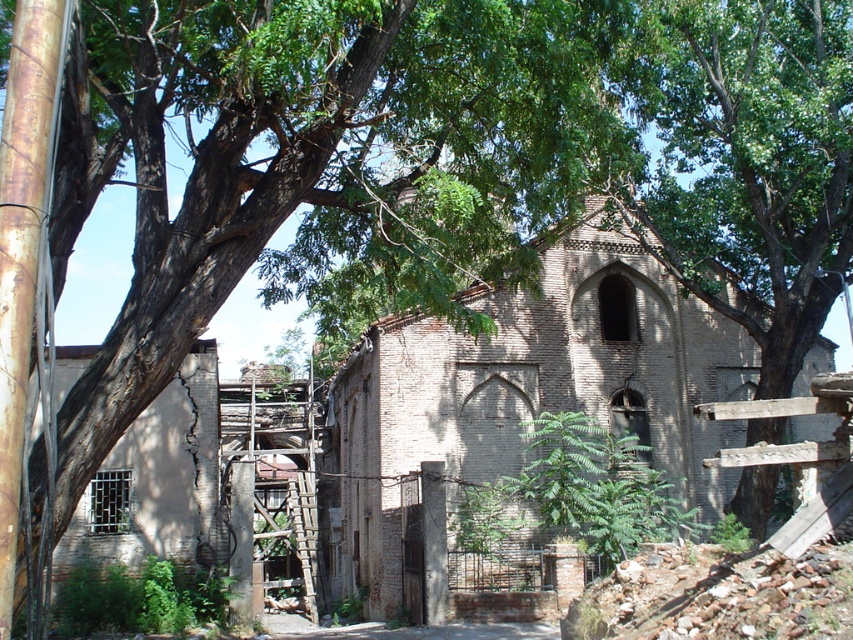
Question: Which point is farther to the camera?

Choices:
 (A) brown brick church at center
 (B) green leafy tree at center
 (C) rusty wooden ladder at center

Answer: (C)

Question: Does green leafy tree at center come in front of rusty wooden ladder at center?

Choices:
 (A) no
 (B) yes

Answer: (B)

Question: Is brown brick church at center smaller than rusty wooden ladder at center?

Choices:
 (A) no
 (B) yes

Answer: (A)

Question: Which point appears closest to the camera in this image?

Choices:
 (A) 573,349
 (B) 303,582
 (C) 819,195

Answer: (C)

Question: Is brown brick church at center further to camera compared to green leafy tree at center?

Choices:
 (A) yes
 (B) no

Answer: (A)

Question: Among these points, which one is nearest to the camera?

Choices:
 (A) (624, 212)
 (B) (456, 488)

Answer: (A)